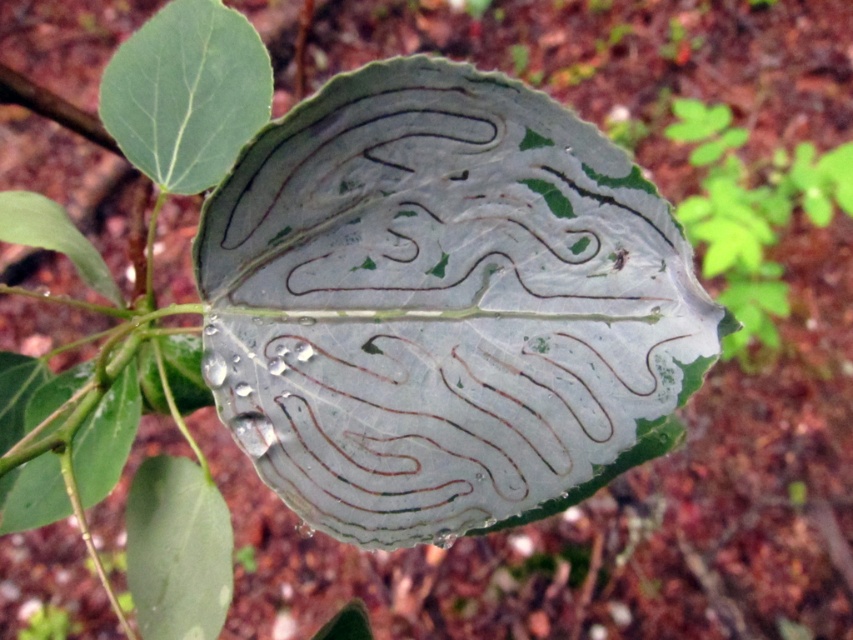
Question: Is green matte leaf at upper left to the left of green translucent leaf at lower left from the viewer's perspective?

Choices:
 (A) yes
 (B) no

Answer: (B)

Question: Among these points, which one is farthest from the camera?

Choices:
 (A) (112, 90)
 (B) (106, 392)

Answer: (A)

Question: Which point is farther to the camera?

Choices:
 (A) (171, 600)
 (B) (225, 19)
 (C) (64, 490)

Answer: (C)

Question: Can you confirm if green matte leaf at lower left is wider than green translucent leaf at lower left?

Choices:
 (A) yes
 (B) no

Answer: (B)

Question: Which object is closer to the camera taking this photo?

Choices:
 (A) green matte leaf at lower left
 (B) green matte leaf at upper left
 (C) green translucent leaf at lower left

Answer: (A)

Question: Observing the image, what is the correct spatial positioning of green matte leaf at upper left in reference to green translucent leaf at lower left?

Choices:
 (A) left
 (B) right

Answer: (B)